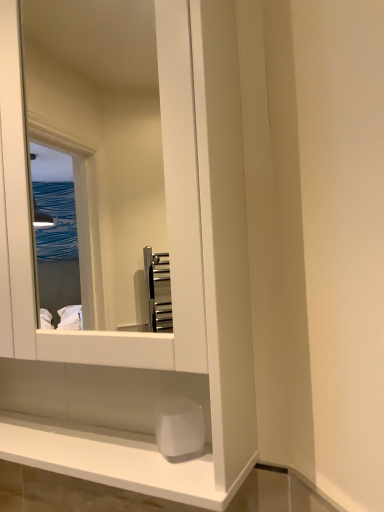
Question: Considering the positions of white glossy mirror at center and white matte soap at lower center in the image, is white glossy mirror at center taller or shorter than white matte soap at lower center?

Choices:
 (A) tall
 (B) short

Answer: (A)

Question: Is white glossy mirror at center in front of or behind white matte soap at lower center in the image?

Choices:
 (A) front
 (B) behind

Answer: (A)

Question: From the image's perspective, is white glossy mirror at center located above or below white matte soap at lower center?

Choices:
 (A) above
 (B) below

Answer: (A)

Question: In terms of height, does white matte soap at lower center look taller or shorter compared to white glossy mirror at center?

Choices:
 (A) short
 (B) tall

Answer: (A)

Question: Considering the positions of point (180, 416) and point (150, 172), is point (180, 416) closer or farther from the camera than point (150, 172)?

Choices:
 (A) farther
 (B) closer

Answer: (B)

Question: Looking at the image, does white matte soap at lower center seem bigger or smaller compared to white glossy mirror at center?

Choices:
 (A) small
 (B) big

Answer: (A)

Question: Is white matte soap at lower center in front of or behind white glossy mirror at center in the image?

Choices:
 (A) behind
 (B) front

Answer: (A)